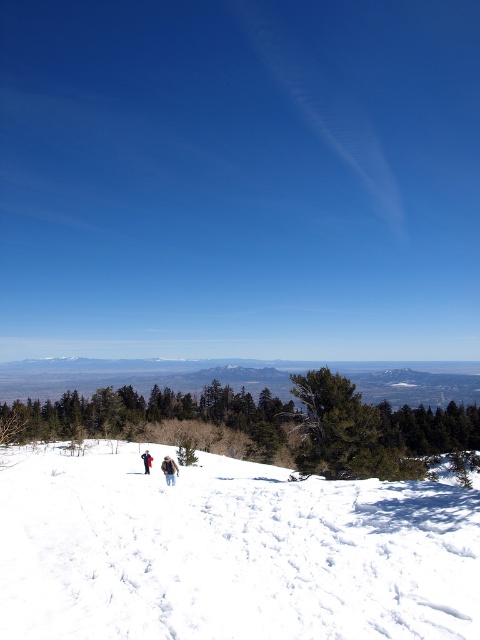
Question: Is brown fuzzy jacket at center smaller than brown woolen jacket at center?

Choices:
 (A) yes
 (B) no

Answer: (A)

Question: In this image, where is white powdery snow at center located relative to brown woolen jacket at center?

Choices:
 (A) above
 (B) below

Answer: (A)

Question: Which point is closer to the camera taking this photo?

Choices:
 (A) (327, 490)
 (B) (167, 468)

Answer: (A)

Question: Based on their relative distances, which object is nearer to the brown fuzzy jacket at center?

Choices:
 (A) brown woolen jacket at center
 (B) white powdery snow at center

Answer: (B)

Question: Is white powdery snow at center positioned behind brown woolen jacket at center?

Choices:
 (A) yes
 (B) no

Answer: (B)

Question: Which point is farther to the camera?

Choices:
 (A) white powdery snow at center
 (B) brown fuzzy jacket at center
 (C) brown woolen jacket at center

Answer: (C)